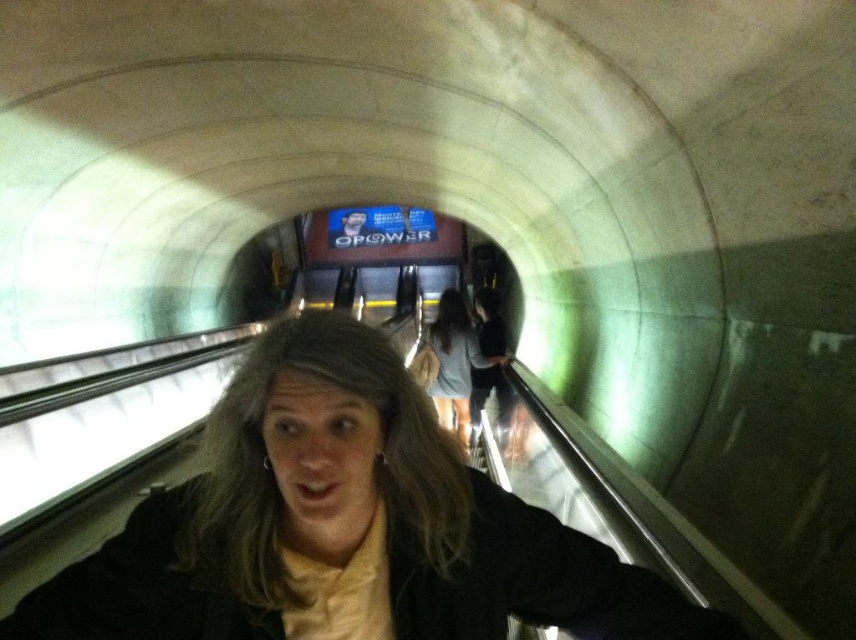
Can you confirm if matte black jacket at center is thinner than light gray fabric skirt at center?

Incorrect, matte black jacket at center's width is not less than light gray fabric skirt at center's.

Which is more to the right, matte black jacket at center or light gray fabric skirt at center?

Positioned to the right is light gray fabric skirt at center.

You are a GUI agent. You are given a task and a screenshot of the screen. Output one action in this format:
    pyautogui.click(x=<x>, y=<y>)
    Task: Click on the matte black jacket at center
    The width and height of the screenshot is (856, 640).
    Given the screenshot: What is the action you would take?
    pyautogui.click(x=345, y=525)